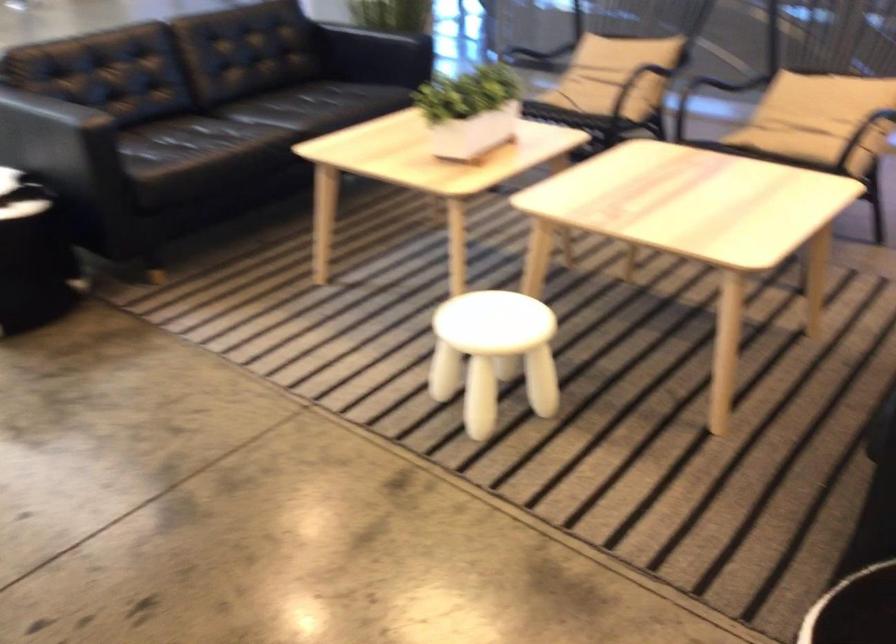
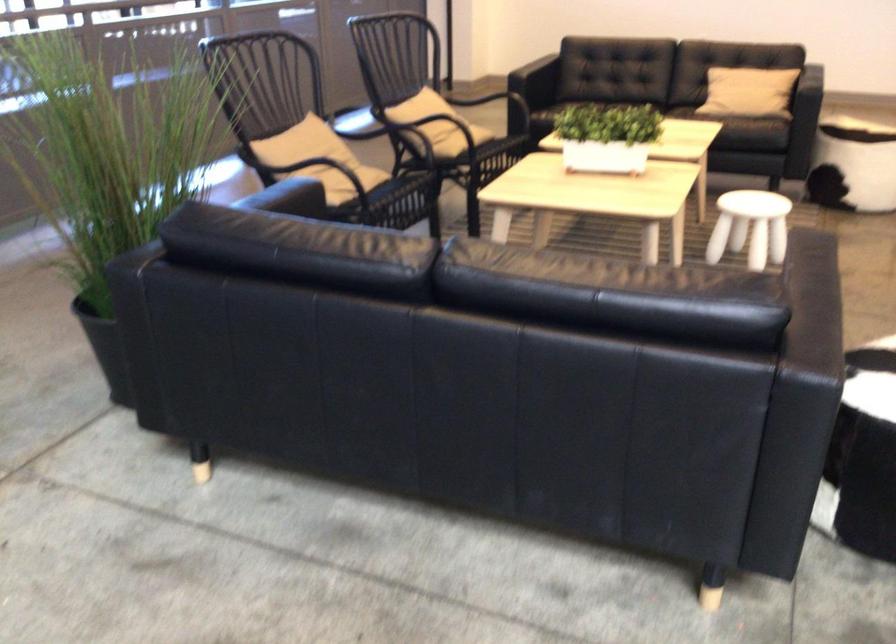
The point at (468, 111) is marked in the first image. Where is the corresponding point in the second image?

(607, 137)